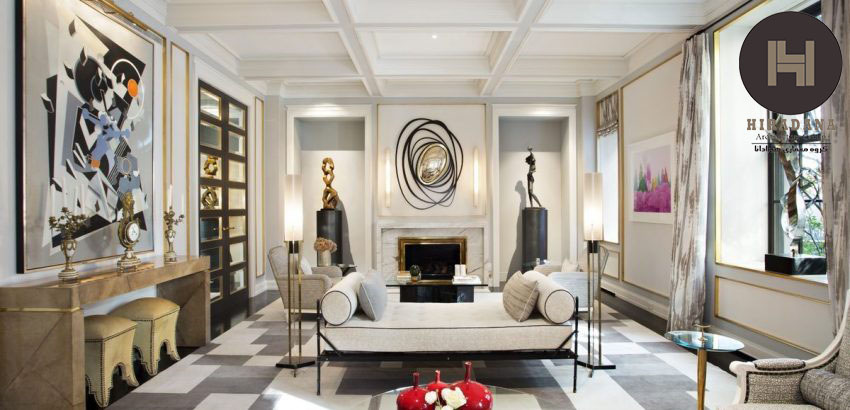
Image resolution: width=850 pixels, height=410 pixels. In order to click on chair in this screenshot , I will do pyautogui.click(x=308, y=276).